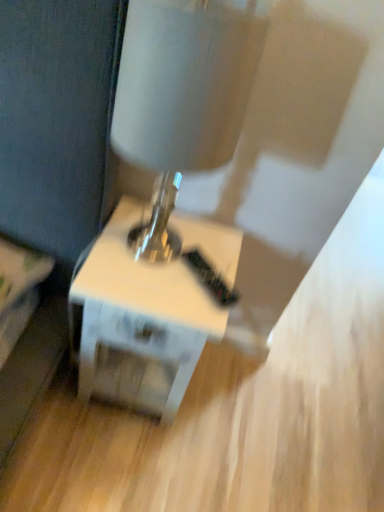
The image size is (384, 512). Describe the element at coordinates (138, 321) in the screenshot. I see `white glossy table at center` at that location.

This screenshot has width=384, height=512. I want to click on white glossy table at center, so click(138, 321).

What is the approximate height of white glossy table at center?

It is 17.94 inches.

Identify the location of metallic silver table lamp at center. pos(183,95).

What do you see at coordinates (183, 95) in the screenshot? I see `metallic silver table lamp at center` at bounding box center [183, 95].

Find the location of a particular element. The height and width of the screenshot is (512, 384). white glossy table at center is located at coordinates (138, 321).

Is white glossy table at center to the left of metallic silver table lamp at center from the viewer's perspective?

Correct, you'll find white glossy table at center to the left of metallic silver table lamp at center.

Considering the positions of objects white glossy table at center and metallic silver table lamp at center in the image provided, who is behind, white glossy table at center or metallic silver table lamp at center?

white glossy table at center is more distant.

Does point (195, 332) come closer to viewer compared to point (171, 184)?

That is True.

From the image's perspective, which is above, white glossy table at center or metallic silver table lamp at center?

metallic silver table lamp at center appears higher in the image.

From a real-world perspective, between white glossy table at center and metallic silver table lamp at center, who is vertically lower?

From a 3D spatial view, white glossy table at center is below.

Considering the sizes of objects white glossy table at center and metallic silver table lamp at center in the image provided, who is thinner, white glossy table at center or metallic silver table lamp at center?

metallic silver table lamp at center.

Is white glossy table at center taller than metallic silver table lamp at center?

No, white glossy table at center is not taller than metallic silver table lamp at center.

Which of these two, white glossy table at center or metallic silver table lamp at center, is bigger?

white glossy table at center.

Is white glossy table at center inside or outside of metallic silver table lamp at center?

white glossy table at center lies outside metallic silver table lamp at center.

Is white glossy table at center next to metallic silver table lamp at center and touching it?

white glossy table at center and metallic silver table lamp at center are not in contact.

Is white glossy table at center looking in the opposite direction of metallic silver table lamp at center?

white glossy table at center is not turned away from metallic silver table lamp at center.

How different are the orientations of white glossy table at center and metallic silver table lamp at center in degrees?

The facing directions of white glossy table at center and metallic silver table lamp at center are 7.62 degrees apart.

Where is `table below the metallic silver table lamp at center (from the image's perspective)`? The height and width of the screenshot is (512, 384). table below the metallic silver table lamp at center (from the image's perspective) is located at coordinates (138, 321).

Based on their positions, is metallic silver table lamp at center located to the left or right of white glossy table at center?

Clearly, metallic silver table lamp at center is on the right of white glossy table at center in the image.

Relative to white glossy table at center, is metallic silver table lamp at center in front or behind?

metallic silver table lamp at center is in front of white glossy table at center.

Does point (186, 145) lie behind point (208, 233)?

That is False.

From the image's perspective, between metallic silver table lamp at center and white glossy table at center, which one is located above?

metallic silver table lamp at center.

From a real-world perspective, is metallic silver table lamp at center on top of white glossy table at center?

Yes, from a real-world perspective, metallic silver table lamp at center is over white glossy table at center

In the scene shown: Considering the sizes of metallic silver table lamp at center and white glossy table at center in the image, is metallic silver table lamp at center wider or thinner than white glossy table at center?

In the image, metallic silver table lamp at center appears to be more narrow than white glossy table at center.

In terms of height, does metallic silver table lamp at center look taller or shorter compared to white glossy table at center?

Clearly, metallic silver table lamp at center is taller compared to white glossy table at center.

Based on the photo, looking at the image, does metallic silver table lamp at center seem bigger or smaller compared to white glossy table at center?

Clearly, metallic silver table lamp at center is smaller in size than white glossy table at center.

Based on the photo, is white glossy table at center located within metallic silver table lamp at center?

That's incorrect, white glossy table at center is not inside metallic silver table lamp at center.

Are metallic silver table lamp at center and white glossy table at center beside each other?

metallic silver table lamp at center and white glossy table at center are clearly separated.

Does metallic silver table lamp at center turn towards white glossy table at center?

No.

Measure the distance between metallic silver table lamp at center and white glossy table at center.

metallic silver table lamp at center and white glossy table at center are 15.74 inches apart.

You are a GUI agent. You are given a task and a screenshot of the screen. Output one action in this format:
    pyautogui.click(x=<x>, y=<y>)
    Task: Click on the table below the metallic silver table lamp at center (from a real-world perspective)
    
    Given the screenshot: What is the action you would take?
    coord(138,321)

This screenshot has height=512, width=384. Find the location of `table lamp in front of the white glossy table at center`. table lamp in front of the white glossy table at center is located at coordinates (183, 95).

Identify the location of table lamp located above the white glossy table at center (from a real-world perspective). (183, 95).